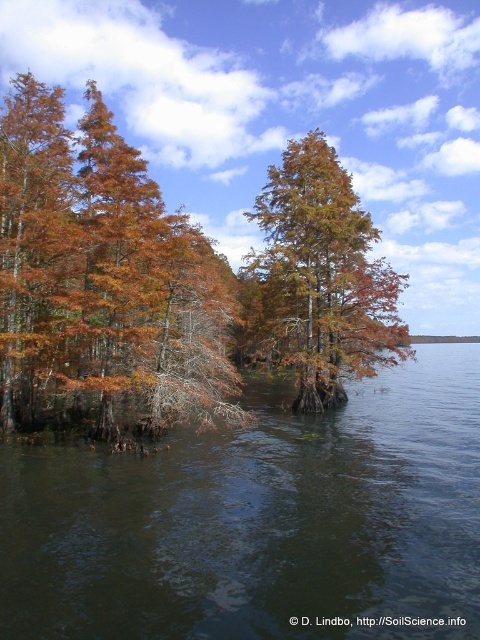
You are standing at the edge of the water body and notice a point marked as point (260, 522). Based on the scene description, what does this point likely represent?

The point (260, 522) likely represents the location of the brown murky water at lower left as described in the scene.